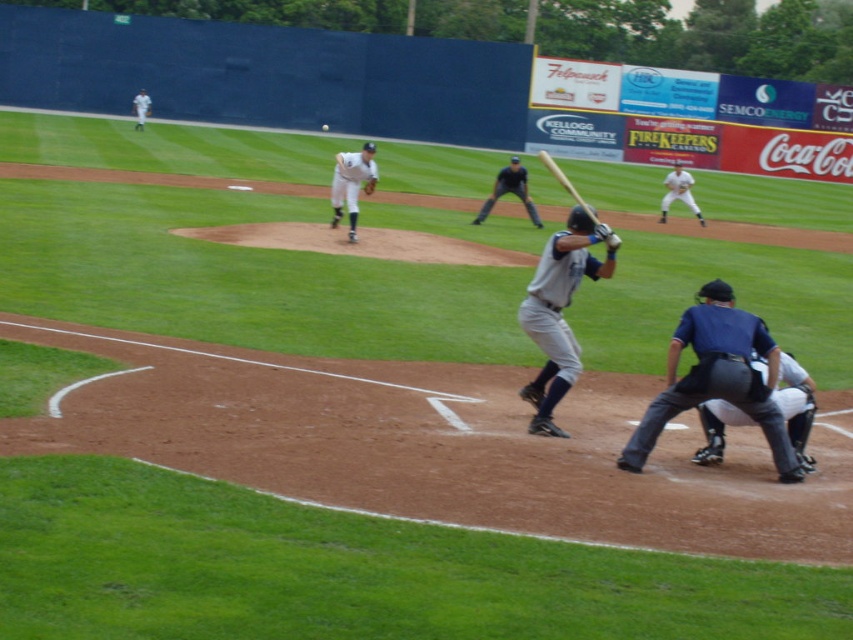
Is dark blue leather glove at lower right taller than white uniform at center?

No.

This screenshot has width=853, height=640. I want to click on dark blue leather glove at lower right, so click(x=796, y=406).

Is point (778, 444) in front of point (688, 204)?

Yes, it is.

Is dark blue uniform at lower right above white uniformed baseball player at center?

Actually, dark blue uniform at lower right is below white uniformed baseball player at center.

Find the location of a particular element. The height and width of the screenshot is (640, 853). dark blue uniform at lower right is located at coordinates [717, 378].

Can you confirm if white uniform at center is positioned to the left of wooden baseball bat at center?

Yes, white uniform at center is to the left of wooden baseball bat at center.

Is point (364, 161) positioned after point (558, 177)?

Yes, it is behind point (558, 177).

At what (x,y) coordinates should I click in order to perform the action: click on white uniform at center. Please return your answer as a coordinate pair (x, y). This screenshot has height=640, width=853. Looking at the image, I should click on (x=351, y=182).